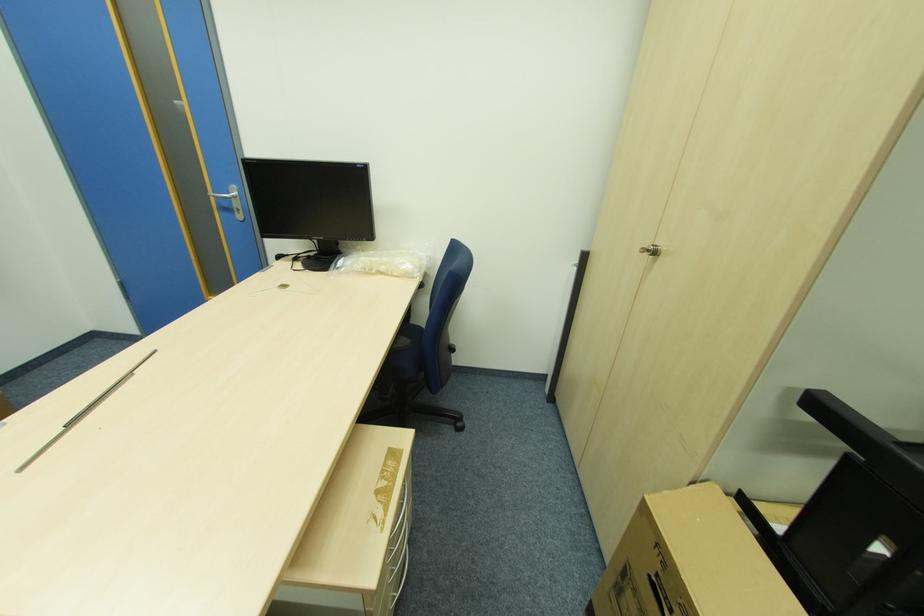
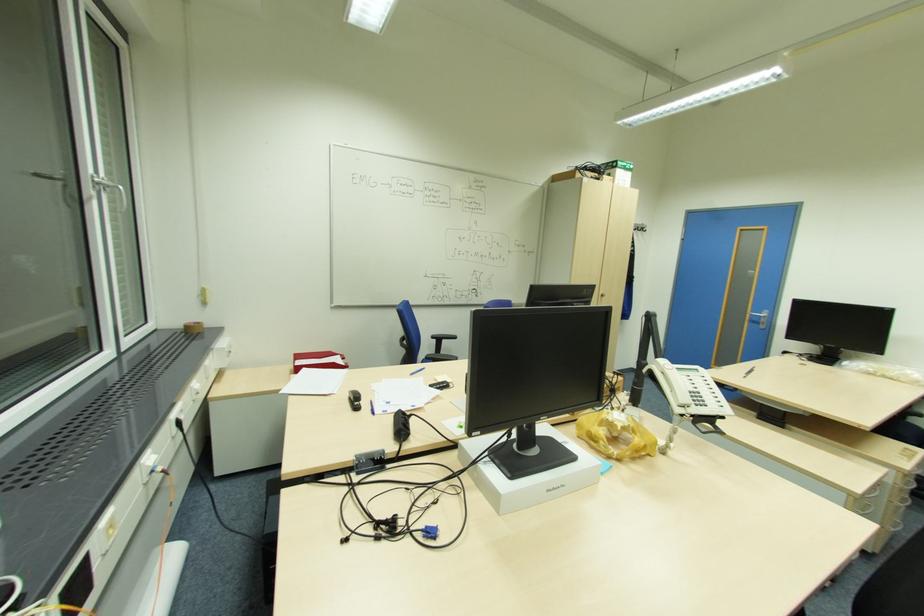
Locate, in the second image, the point that corresponds to [241,209] in the first image.

(766, 323)